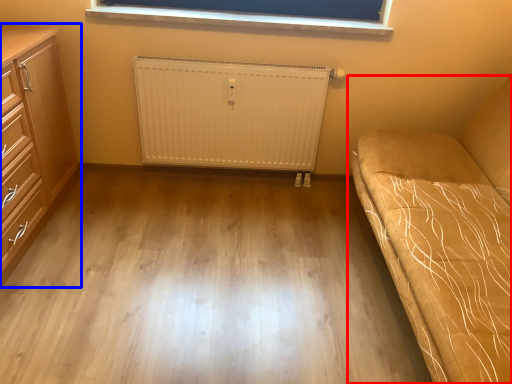
Question: Which of the following is the closest to the observer, studio couch (highlighted by a red box) or chest of drawers (highlighted by a blue box)?

Choices:
 (A) studio couch
 (B) chest of drawers

Answer: (A)